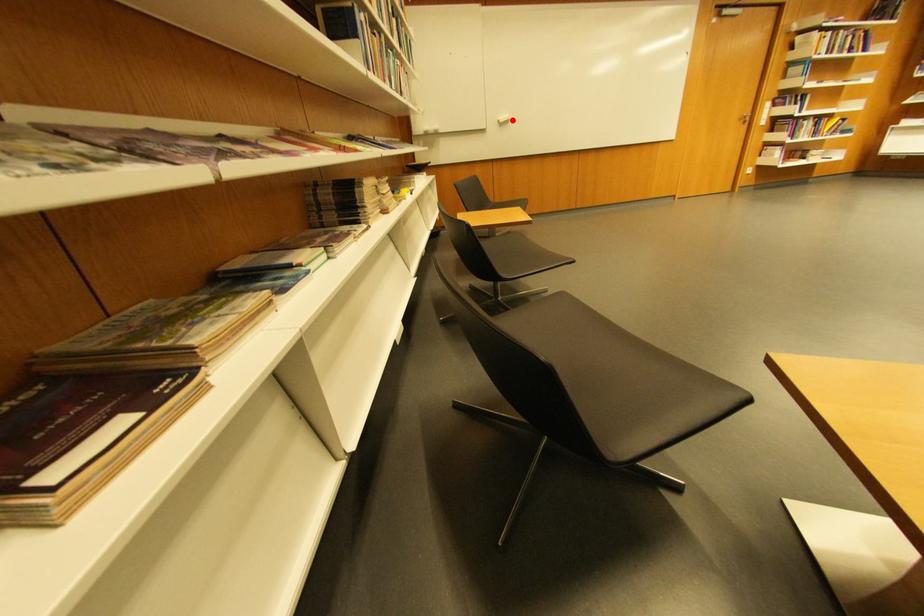
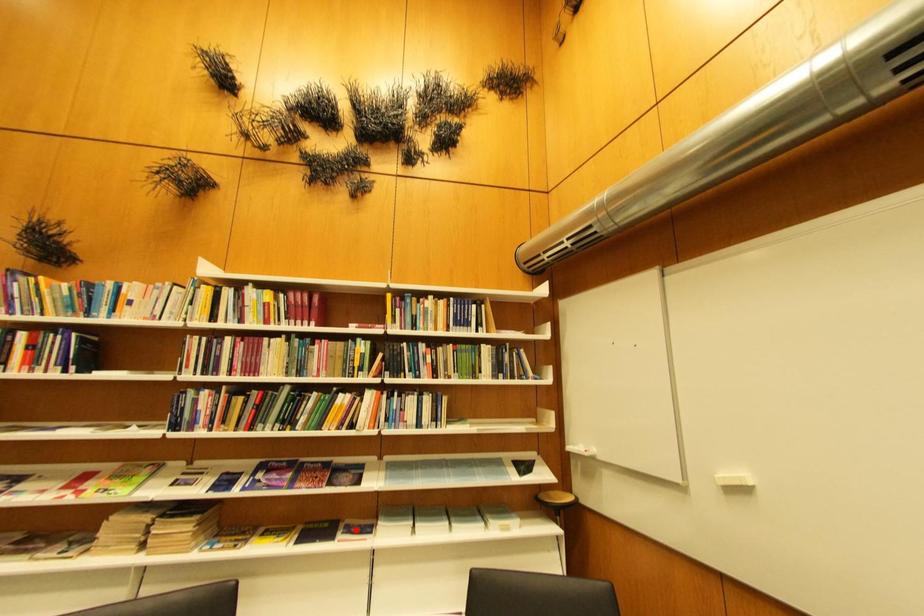
I am providing you with two images of the same scene from different viewpoints. A red point is marked on the first image and another point is marked on the second image. Are the points marked in image1 and image2 representing the same 3D position?

No